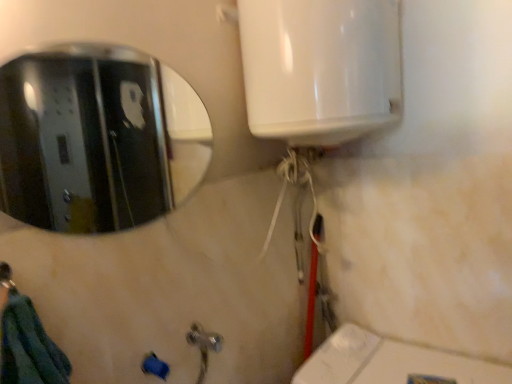
Question: Is polished metallic mirror at upper left in front of or behind brushed metal shower at lower left in the image?

Choices:
 (A) front
 (B) behind

Answer: (B)

Question: In terms of width, does polished metallic mirror at upper left look wider or thinner when compared to brushed metal shower at lower left?

Choices:
 (A) wide
 (B) thin

Answer: (B)

Question: In terms of height, does polished metallic mirror at upper left look taller or shorter compared to brushed metal shower at lower left?

Choices:
 (A) tall
 (B) short

Answer: (A)

Question: Looking at the image, does brushed metal shower at lower left seem bigger or smaller compared to polished metallic mirror at upper left?

Choices:
 (A) big
 (B) small

Answer: (B)

Question: Is point (9, 281) positioned closer to the camera than point (83, 160)?

Choices:
 (A) farther
 (B) closer

Answer: (B)

Question: From the image's perspective, is brushed metal shower at lower left positioned above or below polished metallic mirror at upper left?

Choices:
 (A) above
 (B) below

Answer: (B)

Question: Is brushed metal shower at lower left inside or outside of polished metallic mirror at upper left?

Choices:
 (A) outside
 (B) inside

Answer: (A)